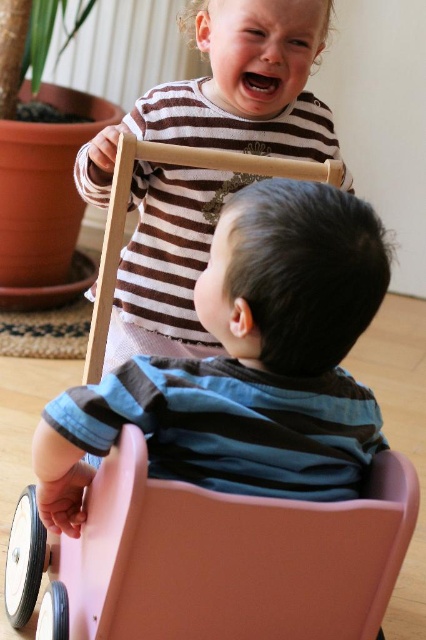
You are a parent trying to organize the living room. You want to move the striped cotton shirt at upper center to the left side of the matte pink plastic chair at center. Is this possible without moving the chair?

The matte pink plastic chair at center is currently on the right side of the striped cotton shirt at upper center. To move the striped cotton shirt at upper center to the left side of the matte pink plastic chair at center, you would need to adjust their positions so that the shirt is now positioned to the left of the chair. Since the question allows moving the shirt without moving the chair, this should be achievable by relocating the striped cotton shirt at upper center to the left of the existing chair.

From the picture: What are the coordinates of the matte pink plastic chair at center?

The coordinates of the matte pink plastic chair at center are point (x=245, y=364).

You are a parent trying to decide whether to place a small potted plant on the matte pink plastic chair at center. Considering the height of the chair and the striped cotton shirt at upper center, will the plant be visible from the front of the chair?

The matte pink plastic chair at center is not as tall as striped cotton shirt at upper center, so the plant placed on the chair may be partially obscured by the striped cotton shirt at upper center from the front view.